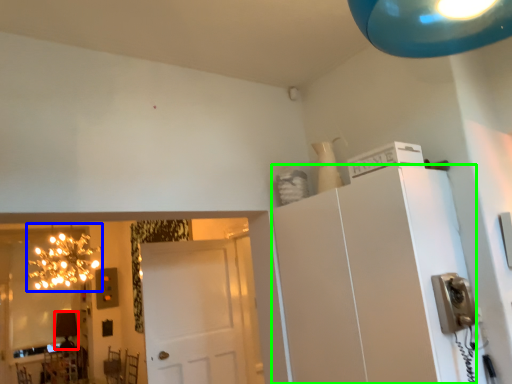
Question: Which is farther away from lamp (highlighted by a red box)? light fixture (highlighted by a blue box) or cabinetry (highlighted by a green box)?

Choices:
 (A) light fixture
 (B) cabinetry

Answer: (B)